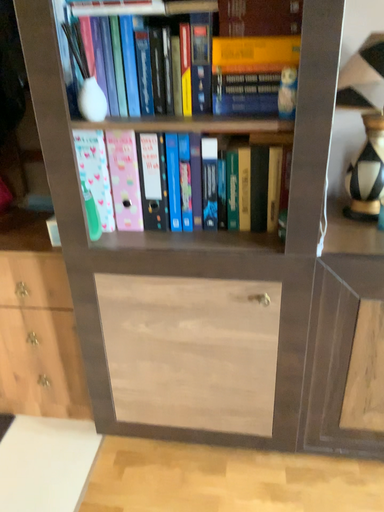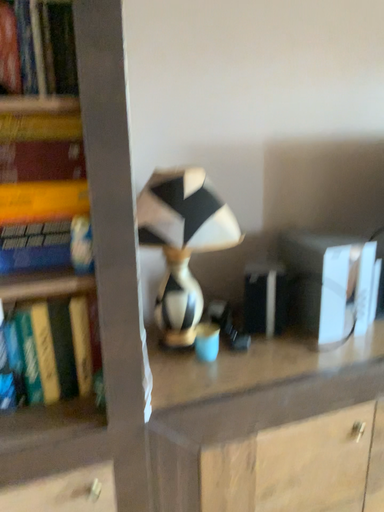
Question: Which way did the camera rotate in the video?

Choices:
 (A) rotated downward
 (B) rotated upward

Answer: (B)